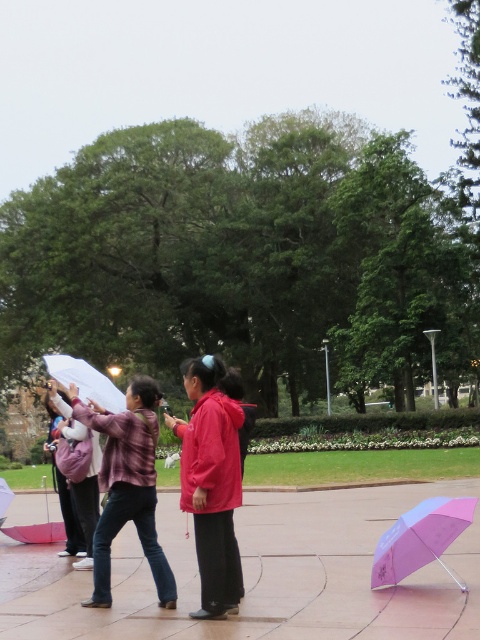
You are a photographer trying to capture a photo of the matte purple jacket at center and the matte purple umbrella at left. Since you want both objects to appear the same size in the photo, which object should you move closer to, and which should you move farther away?

The matte purple jacket at center is smaller than the matte purple umbrella at left. To make them appear the same size in the photo, move closer to the matte purple jacket at center and move farther away from the matte purple umbrella at left.

You are a photographer trying to capture a shot of the group in the rain. You notice the matte red coat at center and the transparent plastic umbrella at lower left. Which object is more to the right in the frame?

The matte red coat at center is positioned on the right side of the transparent plastic umbrella at lower left, so it is more to the right in the frame.

You are a photographer trying to capture a photo of the matte red jacket at center and the white matte umbrella at upper left. Since the rain is coming down sideways, you need to position yourself so that the jacket and umbrella are both visible without getting your camera wet. Given their positions and sizes, which object should you position closer to the edge of your frame to ensure both are visible while keeping the camera dry?

The matte red jacket at center is taller than the white matte umbrella at upper left. To keep the camera dry while capturing both objects, position the taller matte red jacket at center closer to the edge of the frame. This way, the shorter white matte umbrella at upper left can be placed centrally without blocking the jacket, ensuring both are visible and the camera remains sheltered under the umbrella.